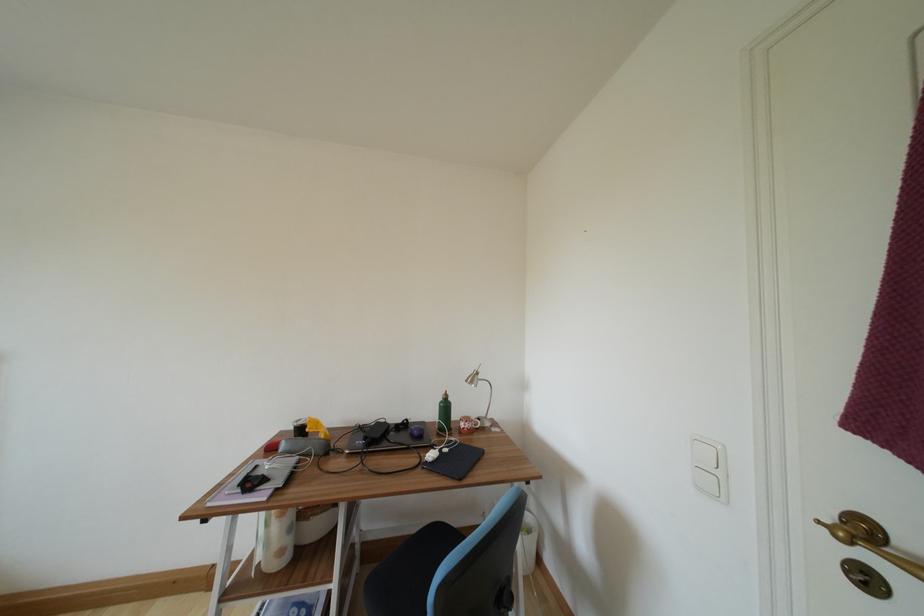
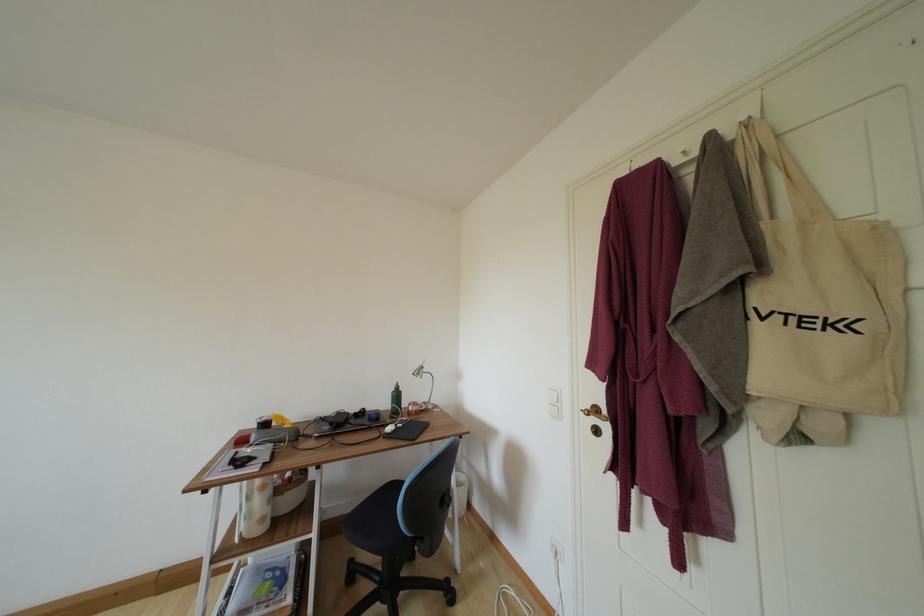
In the second image, find the point that corresponds to [408,429] in the first image.

(367, 416)